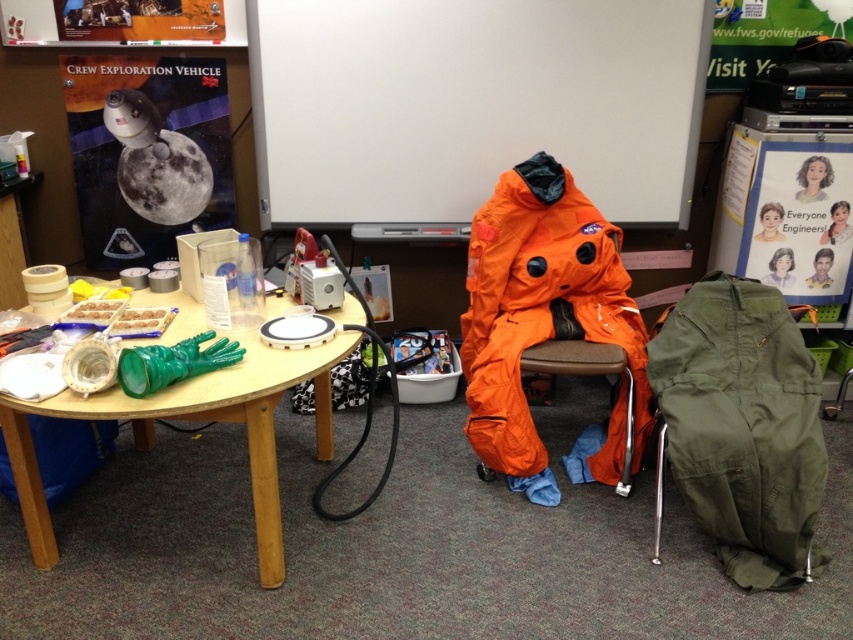
Does olive green fabric at lower right have a larger size compared to woodenobject at lower center?

Actually, olive green fabric at lower right might be smaller than woodenobject at lower center.

Can you confirm if olive green fabric at lower right is positioned to the left of woodenobject at lower center?

Incorrect, olive green fabric at lower right is not on the left side of woodenobject at lower center.

At what (x,y) coordinates should I click in order to perform the action: click on olive green fabric at lower right. Please return your answer as a coordinate pair (x, y). This screenshot has width=853, height=640. Looking at the image, I should click on (741, 426).

Between point (822, 486) and point (827, 289), which one is positioned behind?

Positioned behind is point (827, 289).

This screenshot has height=640, width=853. I want to click on olive green fabric at lower right, so click(x=741, y=426).

You are a GUI agent. You are given a task and a screenshot of the screen. Output one action in this format:
    pyautogui.click(x=<x>, y=<y>)
    Task: Click on the olive green fabric at lower right
    
    Given the screenshot: What is the action you would take?
    pyautogui.click(x=741, y=426)

The height and width of the screenshot is (640, 853). Find the location of `olive green fabric at lower right`. olive green fabric at lower right is located at coordinates (741, 426).

Consider the image. Which of these two, matte plastic poster at upper left or woodenobject at lower center, stands shorter?

matte plastic poster at upper left is shorter.

Does matte plastic poster at upper left appear over woodenobject at lower center?

Yes.

What do you see at coordinates (148, 152) in the screenshot? This screenshot has height=640, width=853. I see `matte plastic poster at upper left` at bounding box center [148, 152].

I want to click on matte plastic poster at upper left, so click(x=148, y=152).